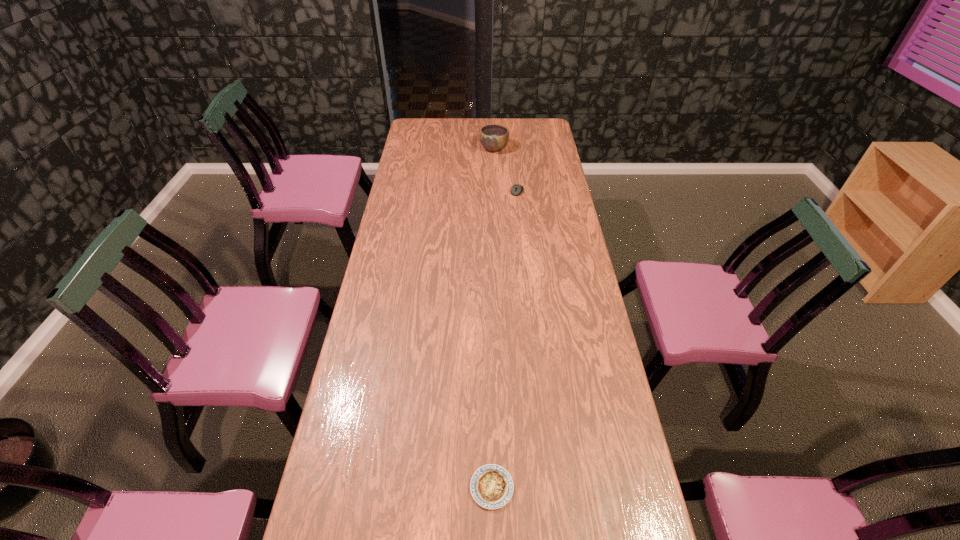
I want to click on the tallest object, so (x=494, y=137).

At what (x,y) coordinates should I click in order to perform the action: click on the farthest object. Please return your answer as a coordinate pair (x, y). This screenshot has height=540, width=960. Looking at the image, I should click on (494, 137).

This screenshot has height=540, width=960. Identify the location of the second nearest object. (517, 189).

This screenshot has width=960, height=540. Find the location of `the second tallest object`. the second tallest object is located at coordinates (517, 189).

You are a GUI agent. You are given a task and a screenshot of the screen. Output one action in this format:
    pyautogui.click(x=<x>, y=<y>)
    Task: Click on the shortest object
    The height and width of the screenshot is (540, 960).
    Given the screenshot: What is the action you would take?
    pyautogui.click(x=491, y=486)

The image size is (960, 540). In order to click on quiche in this screenshot , I will do `click(491, 486)`.

The width and height of the screenshot is (960, 540). I want to click on vacant point located on the front of the bowl, so pyautogui.click(x=495, y=183).

Identify the location of vacant area situated on the front of the computer equipment. (518, 204).

Where is `vacant space situated 0.250m on the back of the nearest object`? vacant space situated 0.250m on the back of the nearest object is located at coordinates (490, 381).

In the image, there is a desktop. Find the location of `vacant space at the far edge`. vacant space at the far edge is located at coordinates (455, 138).